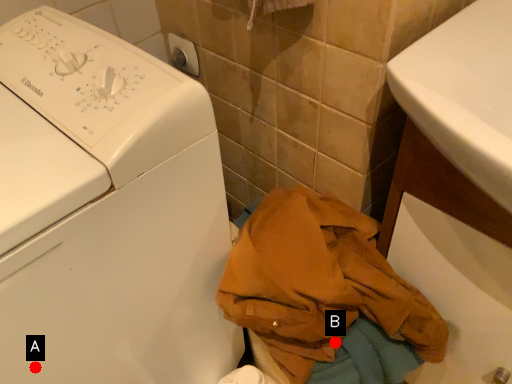
Question: Two points are circled on the image, labeled by A and B beside each circle. Which point is farther from the camera taking this photo?

Choices:
 (A) A is further
 (B) B is further

Answer: (B)